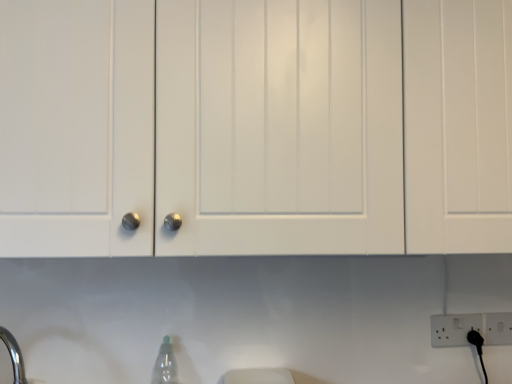
Question: Does transparent plastic bottle at lower center appear on the right side of white plastic electric outlet at lower right?

Choices:
 (A) yes
 (B) no

Answer: (B)

Question: Does transparent plastic bottle at lower center lie behind white plastic electric outlet at lower right?

Choices:
 (A) yes
 (B) no

Answer: (B)

Question: From the image's perspective, would you say transparent plastic bottle at lower center is shown under white plastic electric outlet at lower right?

Choices:
 (A) no
 (B) yes

Answer: (B)

Question: Can white plastic electric outlet at lower right be found inside transparent plastic bottle at lower center?

Choices:
 (A) no
 (B) yes

Answer: (A)

Question: From the image's perspective, is transparent plastic bottle at lower center above white plastic electric outlet at lower right?

Choices:
 (A) yes
 (B) no

Answer: (B)

Question: Is the depth of transparent plastic bottle at lower center less than that of white plastic electric outlet at lower right?

Choices:
 (A) no
 (B) yes

Answer: (B)

Question: Is white plastic electric outlet at lower right shorter than white matte cabinet at center?

Choices:
 (A) yes
 (B) no

Answer: (A)

Question: Is white plastic electric outlet at lower right to the left of white matte cabinet at center from the viewer's perspective?

Choices:
 (A) no
 (B) yes

Answer: (A)

Question: Considering the relative sizes of white plastic electric outlet at lower right and white matte cabinet at center in the image provided, is white plastic electric outlet at lower right smaller than white matte cabinet at center?

Choices:
 (A) no
 (B) yes

Answer: (B)

Question: Does white plastic electric outlet at lower right come behind white matte cabinet at center?

Choices:
 (A) no
 (B) yes

Answer: (B)

Question: From the image's perspective, does white plastic electric outlet at lower right appear lower than white matte cabinet at center?

Choices:
 (A) no
 (B) yes

Answer: (B)

Question: Would you say white plastic electric outlet at lower right is a long distance from white matte cabinet at center?

Choices:
 (A) yes
 (B) no

Answer: (B)

Question: Does transparent plastic bottle at lower center have a larger size compared to white matte cabinet at center?

Choices:
 (A) no
 (B) yes

Answer: (A)